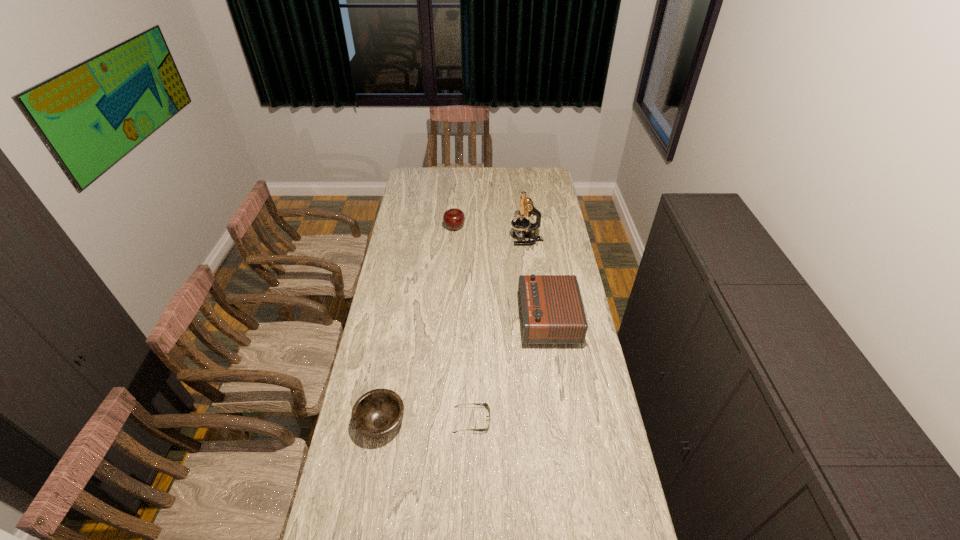
The image size is (960, 540). What are the coordinates of `microscope` in the screenshot? It's located at (526, 207).

At what (x,y) coordinates should I click in order to perform the action: click on the fourth shortest object. Please return your answer as a coordinate pair (x, y). The height and width of the screenshot is (540, 960). Looking at the image, I should click on (551, 310).

This screenshot has height=540, width=960. Identify the location of radio receiver. (551, 310).

Locate an element on the screen. The height and width of the screenshot is (540, 960). apple is located at coordinates (454, 218).

The width and height of the screenshot is (960, 540). Find the location of `the leftmost object`. the leftmost object is located at coordinates (378, 413).

The image size is (960, 540). In order to click on bowl in this screenshot , I will do click(x=378, y=413).

The image size is (960, 540). Identify the location of the shortest object. (485, 405).

Find the location of a particular element. vacant space located at the eyepiece of the microscope is located at coordinates (486, 240).

The image size is (960, 540). In order to click on vacant space located 0.320m at the eyepiece of the microscope in this screenshot , I will do `click(447, 240)`.

Where is `vacant point located at the eyepiece of the microscope`? This screenshot has height=540, width=960. vacant point located at the eyepiece of the microscope is located at coordinates (470, 240).